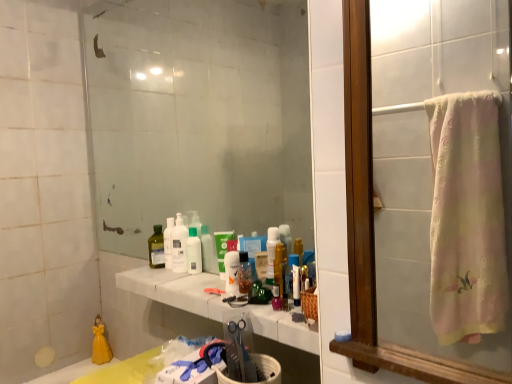
Where is `free space to the left of translucent plastic mouthwash at center, the 1th mouthwash viewed from the front`? free space to the left of translucent plastic mouthwash at center, the 1th mouthwash viewed from the front is located at coordinates (195, 286).